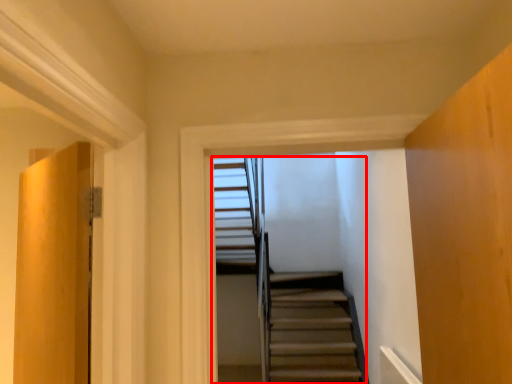
Question: From the image's perspective, where is stairs (annotated by the red box) located relative to door?

Choices:
 (A) above
 (B) below

Answer: (A)